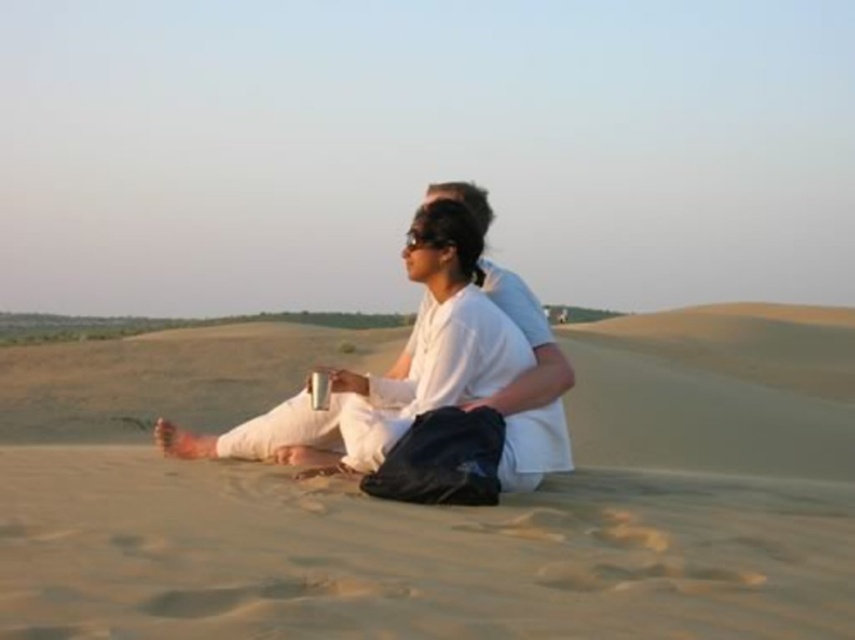
Does sandy beige sand at center have a greater width compared to black matte goggles at center?

Yes.

Which is more to the right, sandy beige sand at center or black matte goggles at center?

From the viewer's perspective, sandy beige sand at center appears more on the right side.

What do you see at coordinates (441, 508) in the screenshot? I see `sandy beige sand at center` at bounding box center [441, 508].

Where is `sandy beige sand at center`? The image size is (855, 640). sandy beige sand at center is located at coordinates (441, 508).

Is the position of sandy beige sand at center less distant than that of white matte clothing at center?

Yes, sandy beige sand at center is in front of white matte clothing at center.

Is point (134, 502) farther from camera compared to point (467, 316)?

That is False.

Who is more forward, [0,548] or [508,348]?

Point [0,548] is in front.

You are a GUI agent. You are given a task and a screenshot of the screen. Output one action in this format:
    pyautogui.click(x=<x>, y=<y>)
    Task: Click on the sandy beige sand at center
    
    Given the screenshot: What is the action you would take?
    pyautogui.click(x=441, y=508)

Is white matte clothing at center to the left of black matte goggles at center from the viewer's perspective?

Yes, white matte clothing at center is to the left of black matte goggles at center.

Does white matte clothing at center have a smaller size compared to black matte goggles at center?

No.

Describe the element at coordinates (391, 369) in the screenshot. I see `white matte clothing at center` at that location.

Where is `white matte clothing at center`? The height and width of the screenshot is (640, 855). white matte clothing at center is located at coordinates (391, 369).